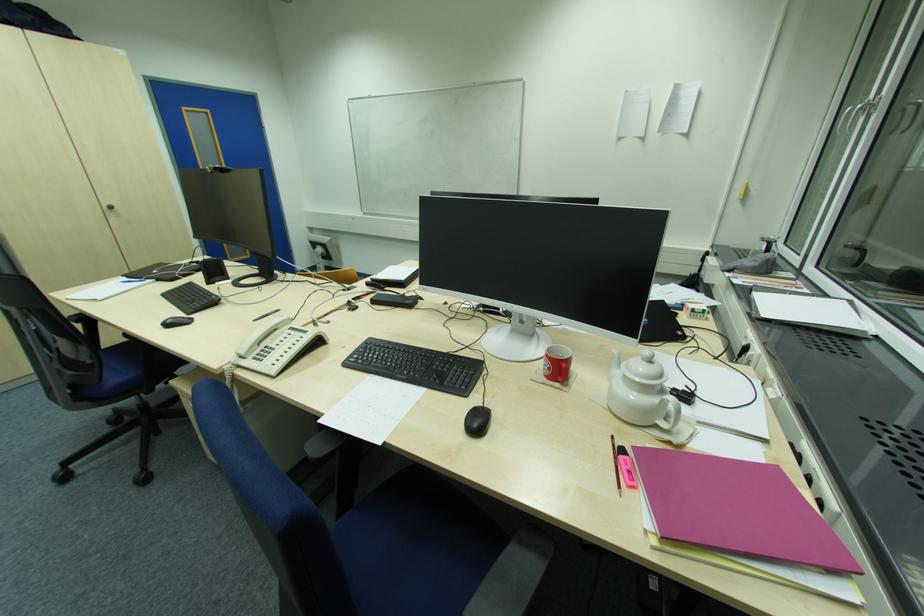
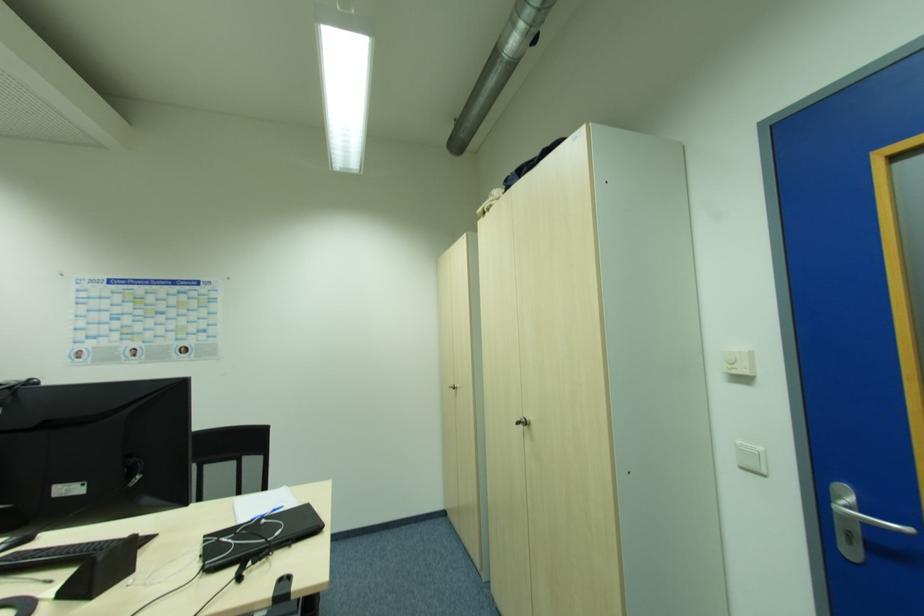
The point at (114, 209) is marked in the first image. Where is the corresponding point in the second image?

(526, 424)